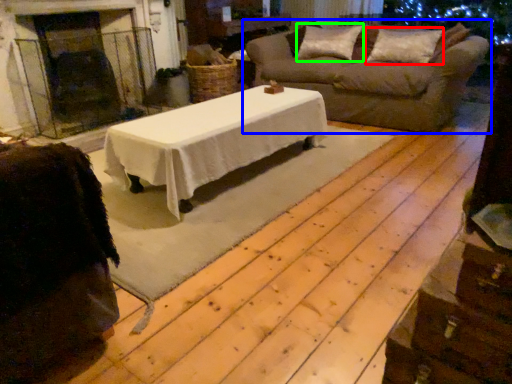
Question: Based on their relative distances, which object is nearer to pillow (highlighted by a red box)? Choose from studio sofa (highlighted by a blue box) and pillow (highlighted by a green box).

Choices:
 (A) studio sofa
 (B) pillow

Answer: (B)